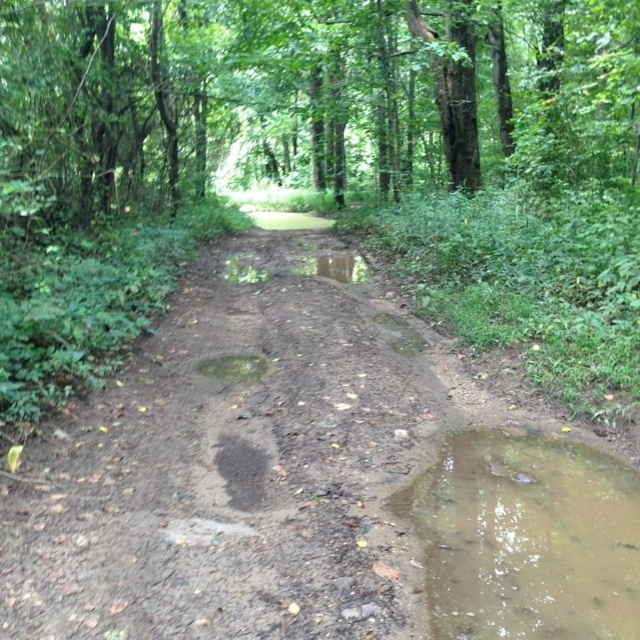
Locate an element on the screen. Image resolution: width=640 pixels, height=640 pixels. green leafy tree at center is located at coordinates (307, 93).

Does point (436, 173) lie in front of point (448, 604)?

No, (436, 173) is behind (448, 604).

Where is `green leafy tree at center`? green leafy tree at center is located at coordinates (307, 93).

Is brown muddy dirt track at center positioned before muddy water at center?

Yes, it is.

Is point (426, 380) in front of point (248, 360)?

Yes, it is.

Locate an element on the screen. The image size is (640, 640). brown muddy dirt track at center is located at coordinates (244, 461).

Who is taller, brown muddy dirt track at center or muddy wet puddle at lower right?

With more height is muddy wet puddle at lower right.

Is point (524, 422) farther from camera compared to point (582, 532)?

Yes.

Identify the location of brown muddy dirt track at center. This screenshot has height=640, width=640. (244, 461).